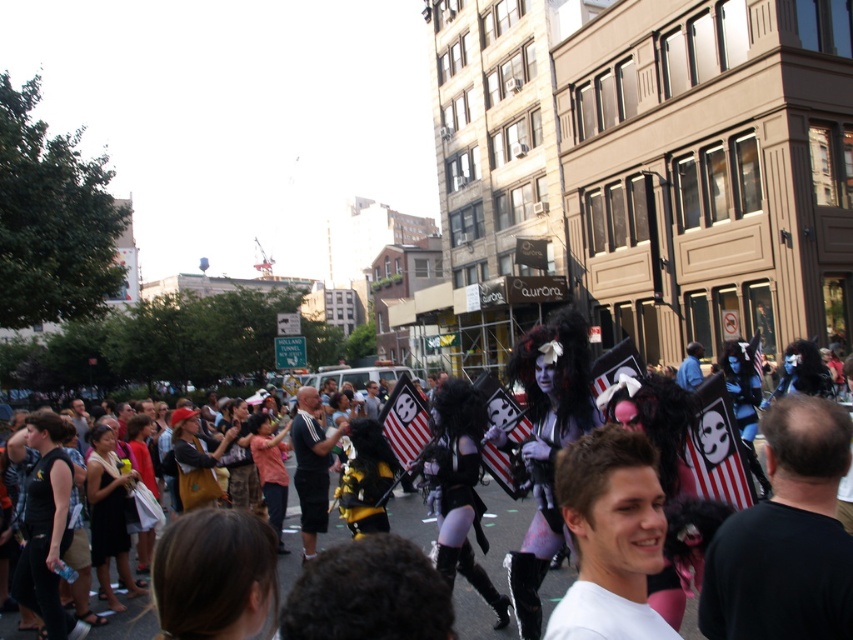
Does white paper flag at center lie in front of striped fabric flag at center?

Yes, it is in front of striped fabric flag at center.

Can you confirm if white paper flag at center is bigger than striped fabric flag at center?

Yes, white paper flag at center is bigger than striped fabric flag at center.

Which is in front, point (746, 458) or point (425, 428)?

Point (746, 458) is more forward.

Image resolution: width=853 pixels, height=640 pixels. In order to click on white paper flag at center in this screenshot , I will do `click(717, 448)`.

I want to click on white paper flag at center, so click(x=717, y=448).

Who is shorter, white paper flag at center or black matte t-shirt at center?

With less height is white paper flag at center.

Between point (714, 404) and point (318, 474), which one is positioned behind?

The point (318, 474) is behind.

Identify the location of white paper flag at center. (717, 448).

Who is higher up, white matte shirt at center or black matte t-shirt at center?

white matte shirt at center is higher up.

Can you confirm if white matte shirt at center is positioned above black matte t-shirt at center?

Indeed, white matte shirt at center is positioned over black matte t-shirt at center.

The width and height of the screenshot is (853, 640). Describe the element at coordinates (610, 536) in the screenshot. I see `white matte shirt at center` at that location.

Image resolution: width=853 pixels, height=640 pixels. Identify the location of white matte shirt at center. (610, 536).